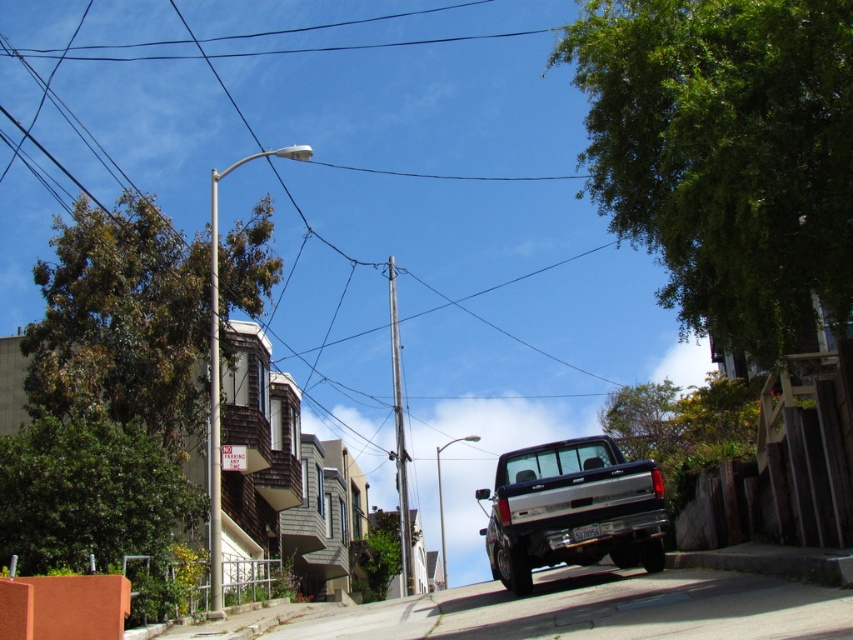
Can you confirm if green leafy tree at upper left is smaller than green leafy tree at center?

No.

Which of these two, green leafy tree at upper left or green leafy tree at center, stands taller?

green leafy tree at upper left is taller.

Is point (178, 404) farther from viewer compared to point (397, 576)?

No, it is not.

Identify the location of green leafy tree at upper left. The height and width of the screenshot is (640, 853). (120, 323).

Does green leafy tree at upper right have a greater width compared to metallic silver pole at upper center?

No.

Is point (793, 209) positioned behind point (216, 221)?

That is False.

At what (x,y) coordinates should I click in order to perform the action: click on green leafy tree at upper right. Please return your answer as a coordinate pair (x, y). Image resolution: width=853 pixels, height=640 pixels. Looking at the image, I should click on (724, 154).

Can you confirm if green leafy tree at upper left is positioned below green leafy tree at lower left?

Actually, green leafy tree at upper left is above green leafy tree at lower left.

Can you confirm if green leafy tree at upper left is bigger than green leafy tree at lower left?

Yes.

What do you see at coordinates (120, 323) in the screenshot? The height and width of the screenshot is (640, 853). I see `green leafy tree at upper left` at bounding box center [120, 323].

The width and height of the screenshot is (853, 640). What are the coordinates of `green leafy tree at upper left` in the screenshot? It's located at (120, 323).